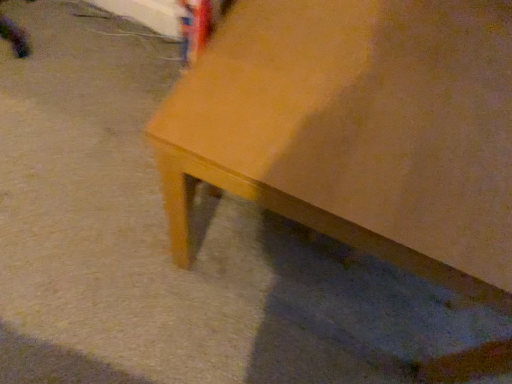
Image resolution: width=512 pixels, height=384 pixels. What are the coordinates of `vacant space situated on the left part of matte wood table at lower right` in the screenshot? It's located at (92, 172).